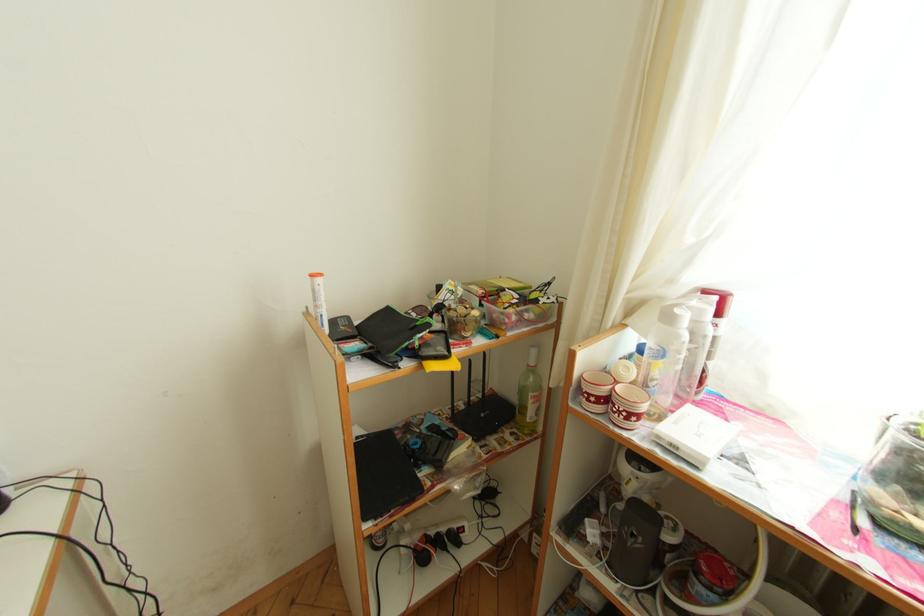
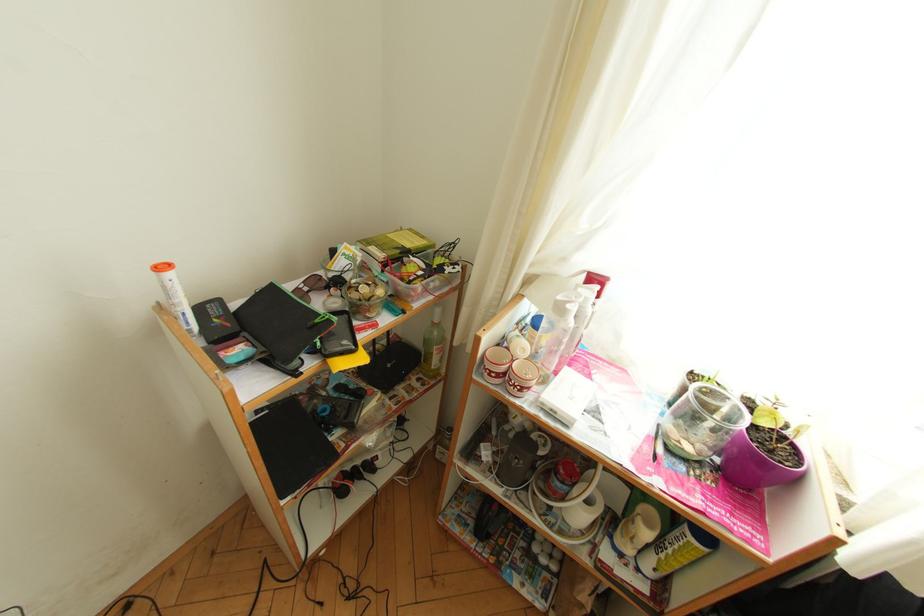
What movement of the cameraman would produce the second image?

The cameraman walked toward left, forward.